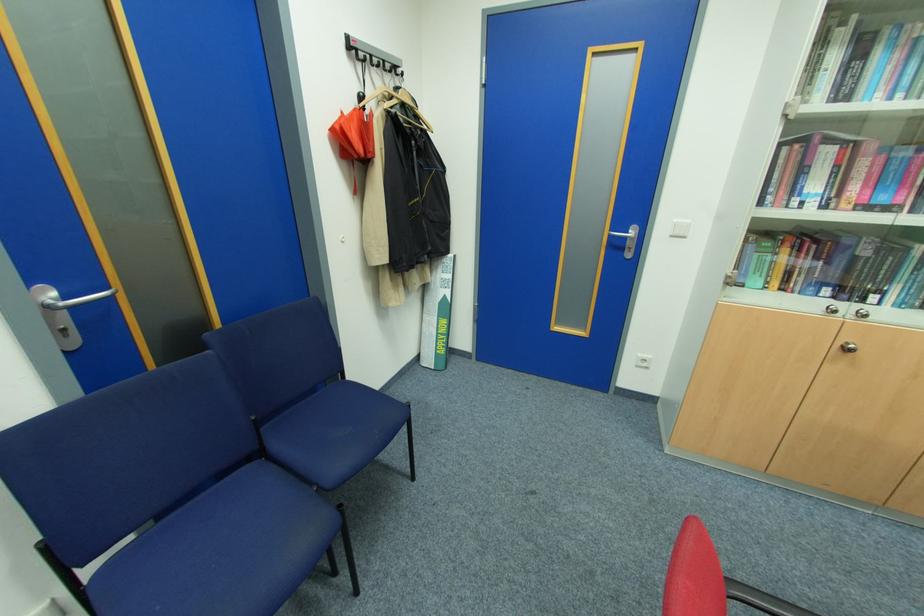
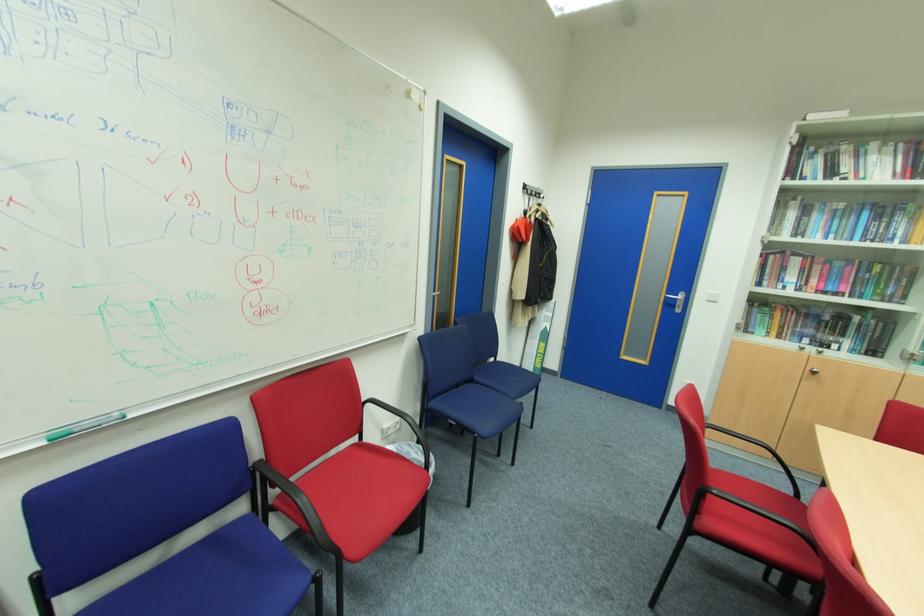
Locate, in the second image, the point that corresponds to (856,346) in the first image.

(820, 371)